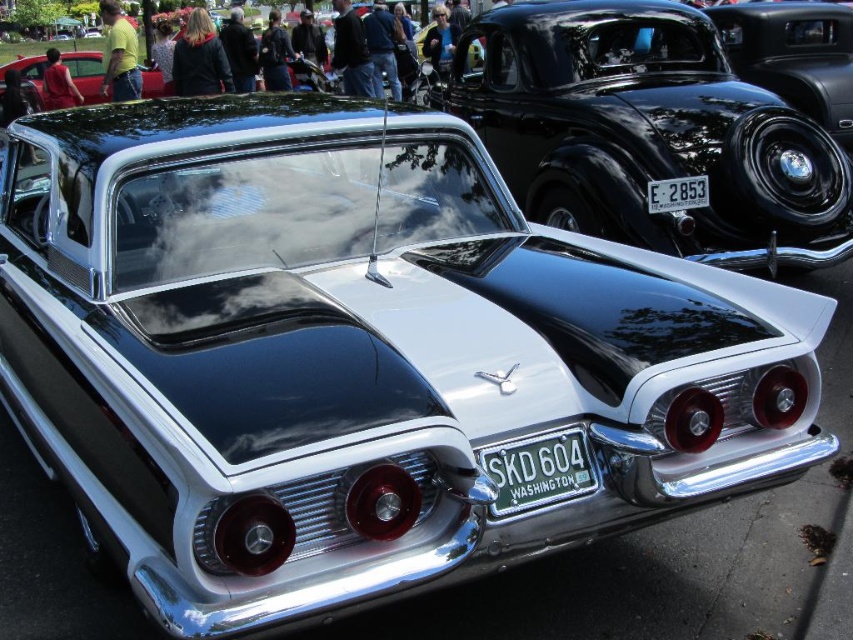
You are standing at the entrance of the classic car event and want to take a photo that includes both the point at coordinates point (583, 192) and point (692, 205). Which point should you focus on first to ensure both are in focus?

You should focus on point (583, 192) first because it is closer to you than point (692, 205), so adjusting focus from near to far will help both points be in focus.

You are a photographer at the car event. You want to capture a photo that includes both the shiny black car at upper right and the white plastic license plate at center. Based on their positions, which one should you focus on first to ensure both are in frame?

The shiny black car at upper right is above the white plastic license plate at center, so you should focus on the shiny black car at upper right first to ensure both are in frame.

You are a photographer at the event and want to capture both the shiny black car at upper right and the green metallic license plate at center in a single frame. Given that your camera has a fixed focal length, which object should you position closer to the camera to ensure both are in focus?

The shiny black car at upper right is much taller than the green metallic license plate at center. To ensure both are in focus, you should position the shiny black car at upper right closer to the camera since it is taller and requires more space in the frame.